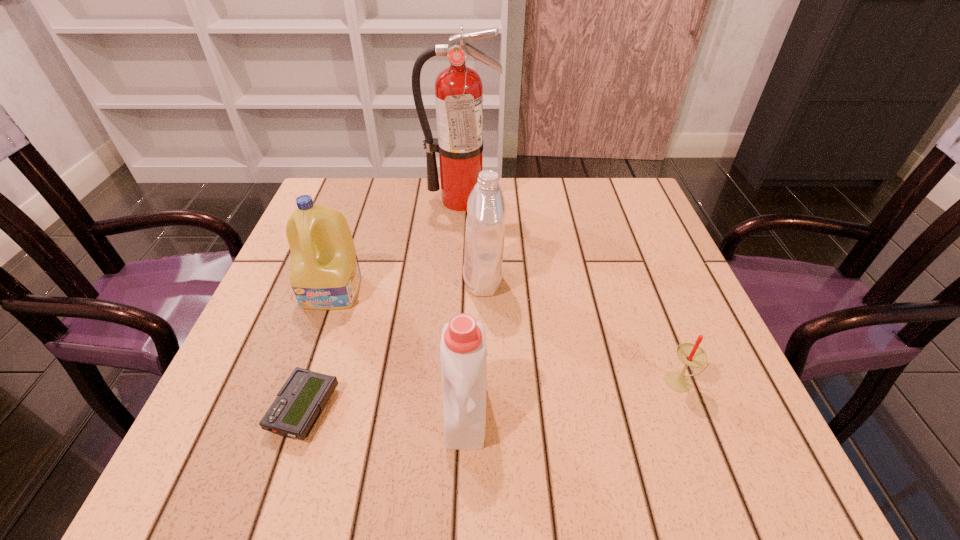
Identify the location of vacant space located 0.090m on the back of the beeper. (327, 338).

You are a GUI agent. You are given a task and a screenshot of the screen. Output one action in this format:
    pyautogui.click(x=<x>, y=<y>)
    Task: Click on the object located at the far edge
    This screenshot has height=540, width=960.
    Given the screenshot: What is the action you would take?
    pyautogui.click(x=458, y=89)

This screenshot has height=540, width=960. What are the coordinates of `detergent that is at the near edge` in the screenshot? It's located at (463, 354).

The image size is (960, 540). I want to click on beeper positioned at the near edge, so click(x=298, y=405).

This screenshot has height=540, width=960. Identify the location of detergent that is at the left edge. (324, 271).

Identify the location of beeper at the left edge. This screenshot has width=960, height=540. (298, 405).

Find the location of a particular element. The height and width of the screenshot is (540, 960). object that is at the right edge is located at coordinates (690, 354).

Where is `object at the near left corner`? object at the near left corner is located at coordinates (298, 405).

Find the location of a particular element. This screenshot has height=540, width=960. vacant area at the far edge is located at coordinates (515, 188).

The height and width of the screenshot is (540, 960). I want to click on vacant space at the near edge of the desktop, so pyautogui.click(x=537, y=435).